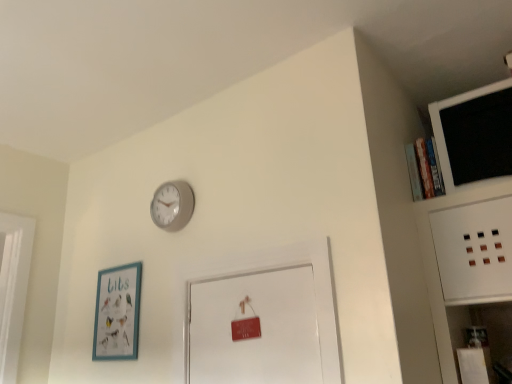
Question: Considering the positions of matte gray clock at upper center and black matte computer monitor at upper right in the image, is matte gray clock at upper center bigger or smaller than black matte computer monitor at upper right?

Choices:
 (A) small
 (B) big

Answer: (A)

Question: In the image, is matte gray clock at upper center positioned in front of or behind black matte computer monitor at upper right?

Choices:
 (A) behind
 (B) front

Answer: (A)

Question: Which of these objects is positioned farthest from the black matte computer monitor at upper right?

Choices:
 (A) matte gray clock at upper center
 (B) teal matte picture frame at lower left

Answer: (B)

Question: Which is farther from the matte gray clock at upper center?

Choices:
 (A) black matte computer monitor at upper right
 (B) teal matte picture frame at lower left

Answer: (A)